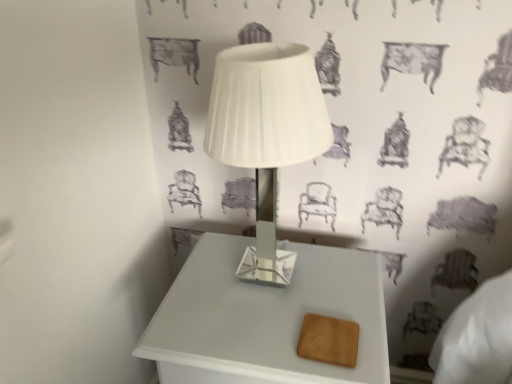
Find the location of a particular element. Image resolution: width=512 pixels, height=384 pixels. empty space that is ontop of white glossy lamp at center (from a real-world perspective) is located at coordinates (269, 51).